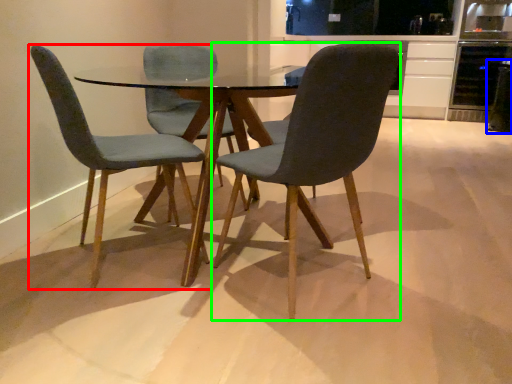
Question: Based on their relative distances, which object is farther from chair (highlighted by a red box)? Choose from appliance (highlighted by a blue box) and chair (highlighted by a green box).

Choices:
 (A) appliance
 (B) chair

Answer: (A)